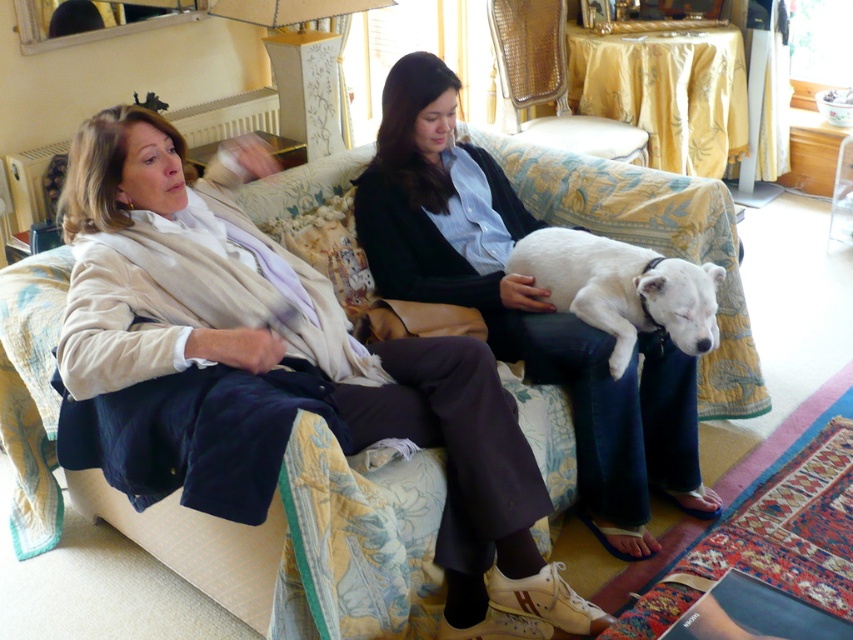
You are standing in the room and want to place a small plant between the two points, point [492,234] and point [541,122]. Which point should the plant be closer to so it is positioned in front of both points?

The plant should be placed closer to point [492,234] because it is in front of point [541,122].

You are a photographer setting up for a portrait shoot in the room. You need to ensure that the matte beige sweater at left and the matte black jacket at center are both visible in the frame. Based on their positions, which object is closer to the camera?

The matte black jacket at center is closer to the camera because the matte beige sweater at left is positioned under it, indicating it is lower in the frame and possibly behind.

Looking at this image, you are a delivery robot with a package that is 22 inches wide. You need to place it between the matte beige sweater at left and the matte black jacket at center on the sofa. Can you fit the package between them?

The distance between the matte beige sweater at left and the matte black jacket at center is 21.08 inches. Since the package is 22 inches wide, it cannot fit between them as the space is slightly narrower than the package.